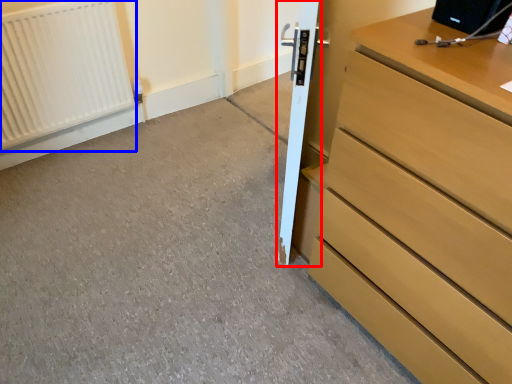
Question: Which object is closer to the camera taking this photo, door (highlighted by a red box) or radiator (highlighted by a blue box)?

Choices:
 (A) door
 (B) radiator

Answer: (A)